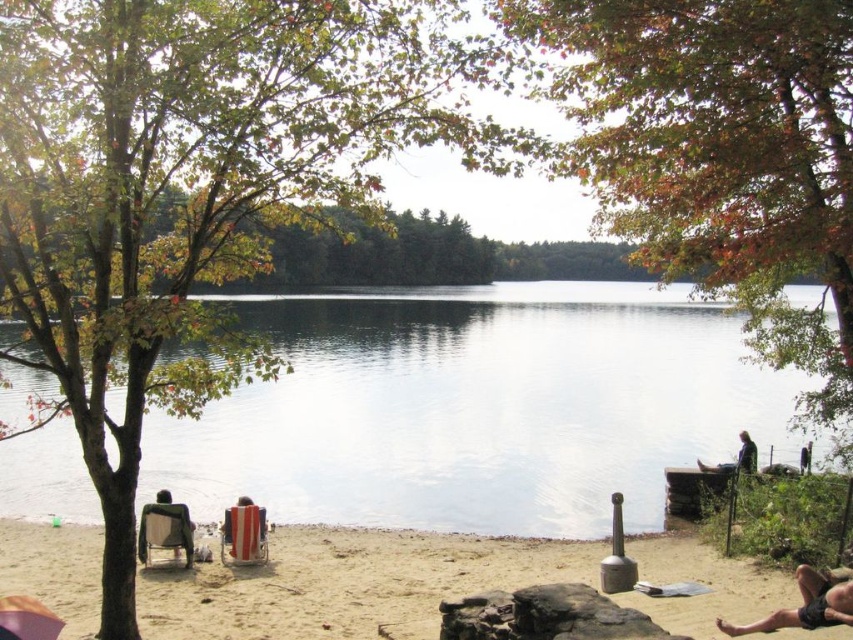
Question: Estimate the real-world distances between objects in this image. Which object is farther from the skinny tan man at lower right?

Choices:
 (A) striped fabric beach chair at lower left
 (B) metallic silver beach chair at lower left
 (C) dark gray fabric chair at lower right
 (D) green leafy tree at upper left

Answer: (C)

Question: Which of the following is the farthest from the observer?

Choices:
 (A) (746, 458)
 (B) (85, 150)

Answer: (A)

Question: Is clear water at center positioned at the back of striped fabric beach chair at lower left?

Choices:
 (A) no
 (B) yes

Answer: (A)

Question: Which of these objects is positioned farthest from the clear water at center?

Choices:
 (A) beige sandy beach at lower center
 (B) metallic silver beach chair at lower left
 (C) green leafy tree at upper left
 (D) orange fabric umbrella at lower left

Answer: (C)

Question: Is green leafy tree at upper left further to camera compared to clear water at center?

Choices:
 (A) yes
 (B) no

Answer: (B)

Question: Does clear water at center appear on the right side of metallic silver beach chair at lower left?

Choices:
 (A) no
 (B) yes

Answer: (B)